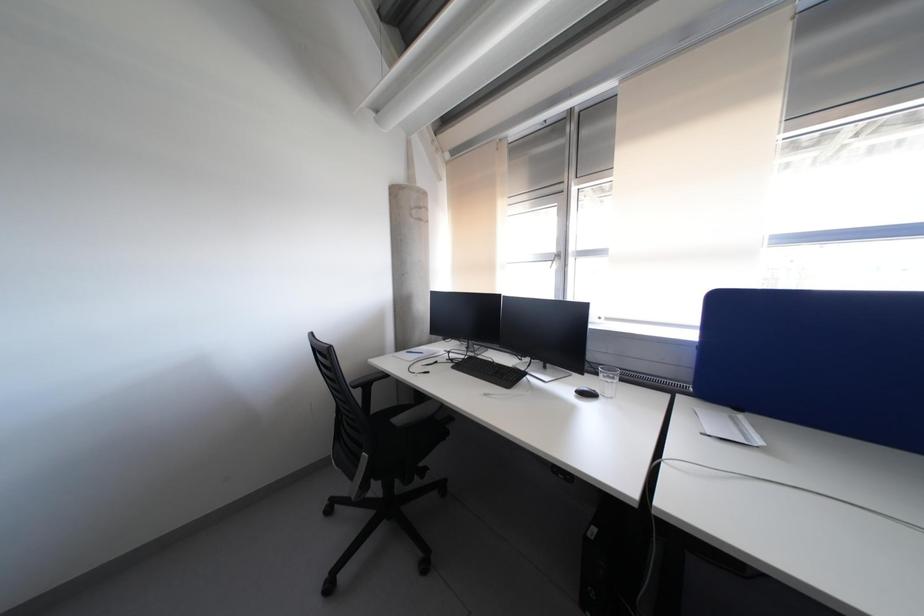
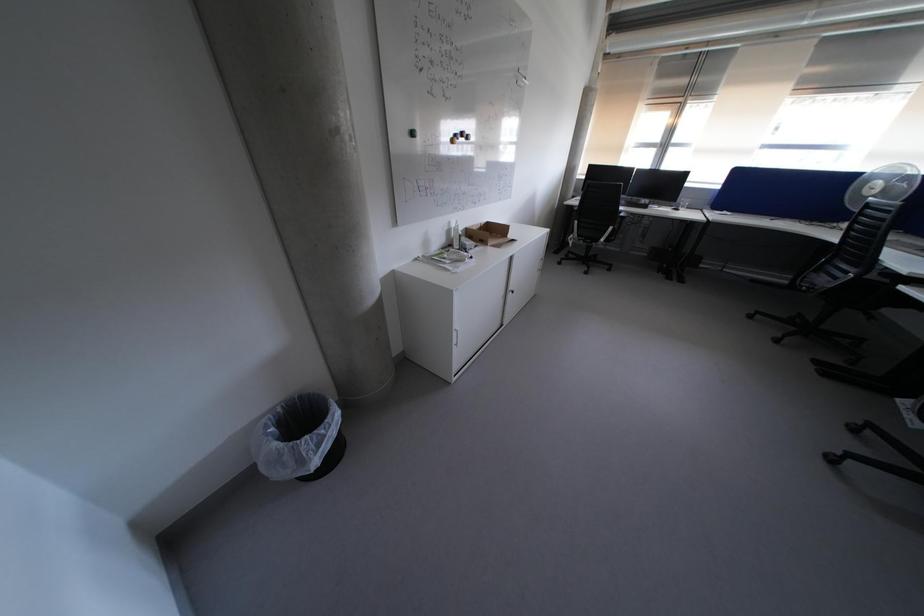
In a continuous first-person perspective shot, in which direction is the camera moving?

The cameraman walked toward left, backward.